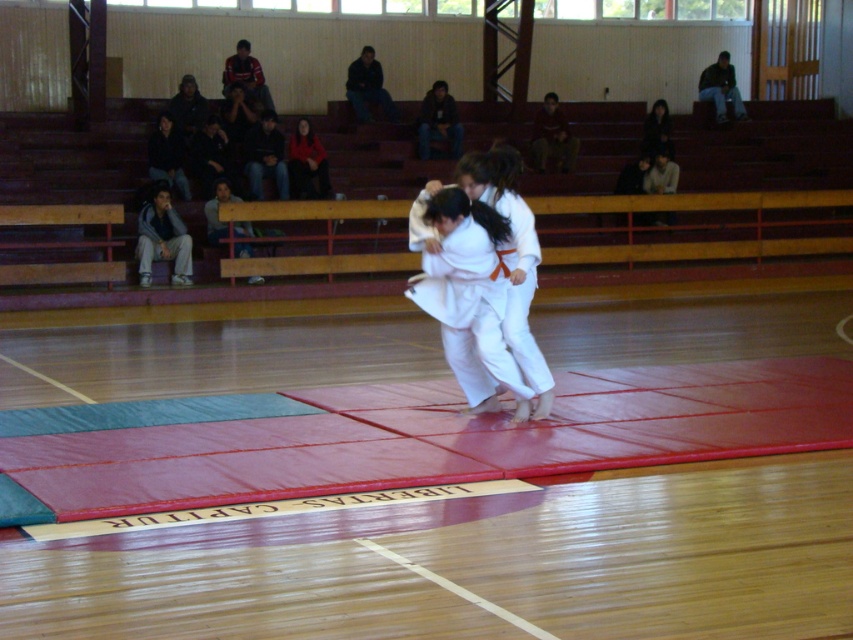
Can you confirm if white cotton kimono at center is shorter than dark brown hair at upper right?

No, white cotton kimono at center is not shorter than dark brown hair at upper right.

Does white cotton kimono at center appear under dark brown hair at upper right?

Yes.

Who is more forward, (515, 376) or (648, 132)?

Point (515, 376) is more forward.

Identify the location of white cotton kimono at center. (466, 292).

Measure the distance between point (440, 202) and camera.

A distance of 9.11 meters exists between point (440, 202) and camera.

Which of these two, white cotton kimono at center or dark fabric jacket at upper left, stands shorter?

With less height is dark fabric jacket at upper left.

Who is more forward, (508,362) or (151,164)?

Positioned in front is point (508,362).

You are a GUI agent. You are given a task and a screenshot of the screen. Output one action in this format:
    pyautogui.click(x=<x>, y=<y>)
    Task: Click on the white cotton kimono at center
    This screenshot has height=640, width=853.
    Given the screenshot: What is the action you would take?
    pyautogui.click(x=466, y=292)

Can you confirm if red velvet sweater at center is positioned to the right of dark fabric jacket at upper left?

Indeed, red velvet sweater at center is positioned on the right side of dark fabric jacket at upper left.

Between point (323, 164) and point (161, 179), which one is positioned in front?

Point (161, 179) is more forward.

Is point (318, 182) more distant than point (177, 148)?

Yes, point (318, 182) is behind point (177, 148).

Image resolution: width=853 pixels, height=640 pixels. What are the coordinates of `red velvet sweater at center` in the screenshot? It's located at (306, 164).